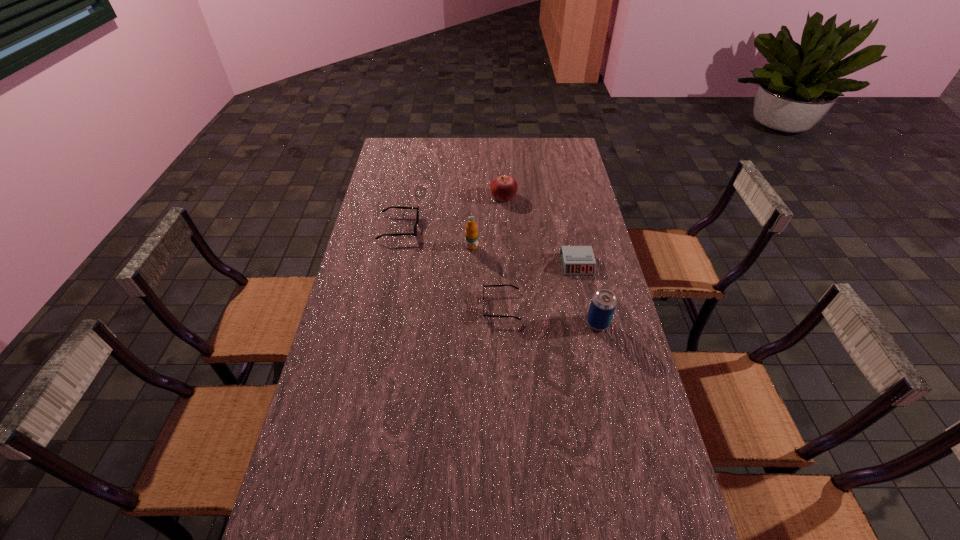
The height and width of the screenshot is (540, 960). I want to click on vacant space situated on the front-facing side of the right sunglasses, so click(440, 306).

At what (x,y) coordinates should I click in order to perform the action: click on vacant point located on the front-facing side of the right sunglasses. Please return your answer as a coordinate pair (x, y). This screenshot has height=540, width=960. Looking at the image, I should click on (421, 306).

In order to click on free space located 0.390m on the front-facing side of the right sunglasses in this screenshot , I will do `click(363, 306)`.

This screenshot has height=540, width=960. I want to click on free location located on the right of the farthest object, so click(558, 197).

I want to click on vacant position located 0.320m on the label of the orange juice, so click(470, 320).

The width and height of the screenshot is (960, 540). I want to click on vacant position located on the back of the fourth farthest object, so click(x=565, y=210).

Where is `free space located on the left of the beer can`? free space located on the left of the beer can is located at coordinates (554, 323).

At what (x,y) coordinates should I click in order to perform the action: click on object at the left edge. Please return your answer as a coordinate pair (x, y). The width and height of the screenshot is (960, 540). Looking at the image, I should click on (414, 233).

The height and width of the screenshot is (540, 960). What are the coordinates of `alarm clock located in the right edge section of the desktop` in the screenshot? It's located at (576, 260).

Locate an element on the screen. This screenshot has height=540, width=960. beer can at the right edge is located at coordinates (603, 303).